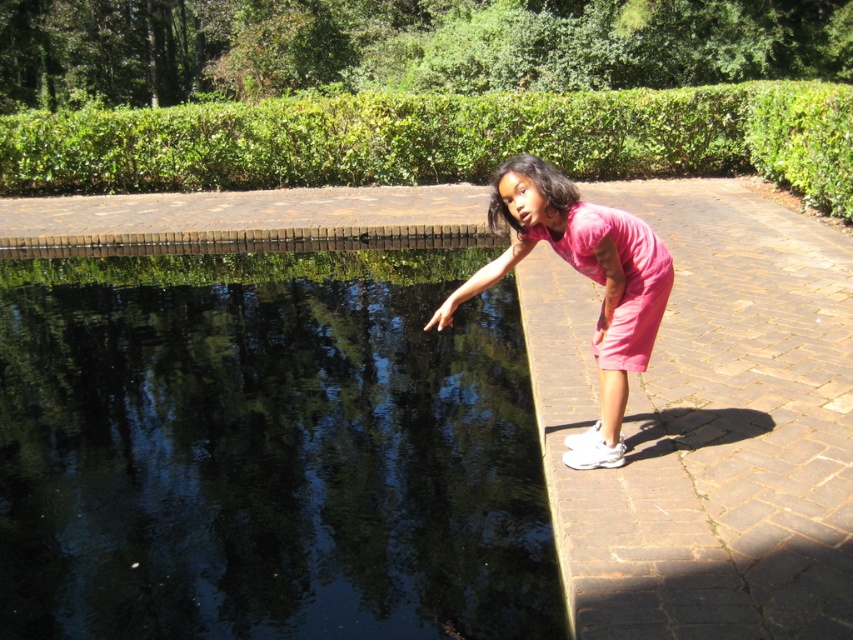
Does black smooth water at center appear on the right side of pink matte dress at right?

Answer: Incorrect, black smooth water at center is not on the right side of pink matte dress at right.

Is black smooth water at center closer to the viewer compared to pink matte dress at right?

No, black smooth water at center is further to the viewer.

Between point (173, 557) and point (566, 232), which one is positioned in front?

Positioned in front is point (566, 232).

Locate an element on the screen. This screenshot has height=640, width=853. black smooth water at center is located at coordinates (267, 451).

Who is lower down, black smooth water at center or pink fabric dress at right?

black smooth water at center

Can you confirm if black smooth water at center is bigger than pink fabric dress at right?

No.

Is point (529, 474) less distant than point (598, 346)?

No, it is behind (598, 346).

I want to click on black smooth water at center, so click(267, 451).

Can you confirm if pink fabric dress at right is smaller than pink matte dress at right?

Incorrect, pink fabric dress at right is not smaller in size than pink matte dress at right.

Does pink fabric dress at right come in front of pink matte dress at right?

No.

Find the location of `pink fabric dress at right`. pink fabric dress at right is located at coordinates (585, 275).